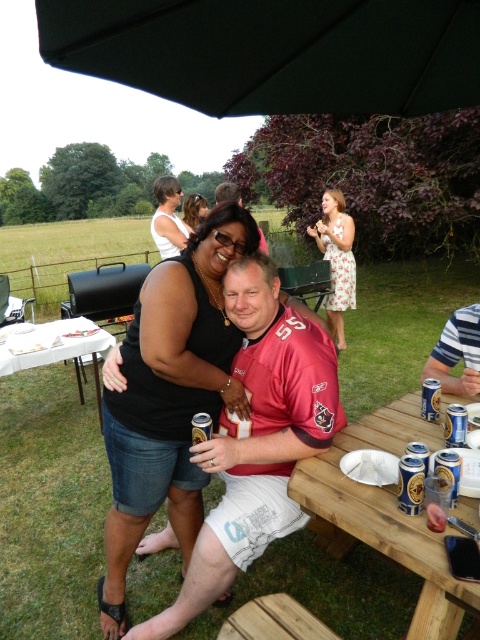
Is floral dress at upper right positioned in front of metallic can at table right?

No, floral dress at upper right is further to the viewer.

Is floral dress at upper right taller than metallic can at table right?

Yes, floral dress at upper right is taller than metallic can at table right.

Who is more distant from viewer, (343, 346) or (453, 488)?

Point (343, 346)

At what (x,y) coordinates should I click in order to perform the action: click on floral dress at upper right. Please return your answer as a coordinate pair (x, y). Image resolution: width=480 pixels, height=640 pixels. Looking at the image, I should click on (336, 259).

Does matte red jersey at center appear on the right side of matte black tank top at upper center?

Yes, matte red jersey at center is to the right of matte black tank top at upper center.

Is point (282, 413) less distant than point (196, 211)?

Yes, point (282, 413) is closer to viewer.

The width and height of the screenshot is (480, 640). In order to click on matte red jersey at center in this screenshot , I will do tap(257, 440).

Does floral dress at upper right come behind striped polo shirt at right?

Yes, floral dress at upper right is further from the viewer.

Is floral dress at upper right positioned in front of striped polo shirt at right?

No, it is not.

Is point (339, 196) positioned behind point (436, 365)?

Yes, it is behind point (436, 365).

You are a GUI agent. You are given a task and a screenshot of the screen. Output one action in this format:
    pyautogui.click(x=<x>, y=<y>)
    Task: Click on the floral dress at upper right
    The height and width of the screenshot is (640, 480).
    Given the screenshot: What is the action you would take?
    pyautogui.click(x=336, y=259)